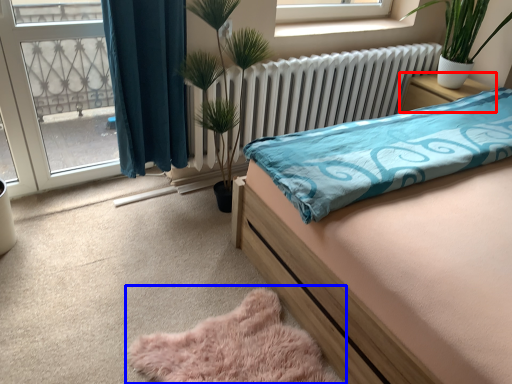
Question: Which object is further to the camera taking this photo, nightstand (highlighted by a red box) or plain (highlighted by a blue box)?

Choices:
 (A) nightstand
 (B) plain

Answer: (A)